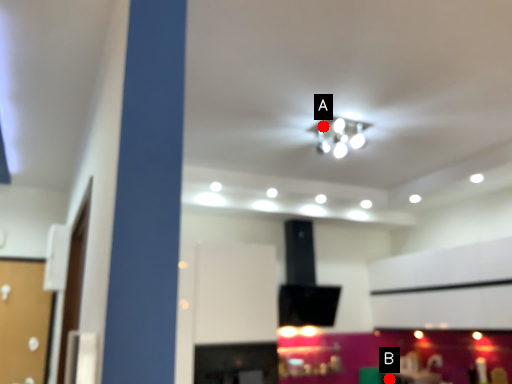
Question: Two points are circled on the image, labeled by A and B beside each circle. Which point is farther from the camera taking this photo?

Choices:
 (A) A is further
 (B) B is further

Answer: (B)